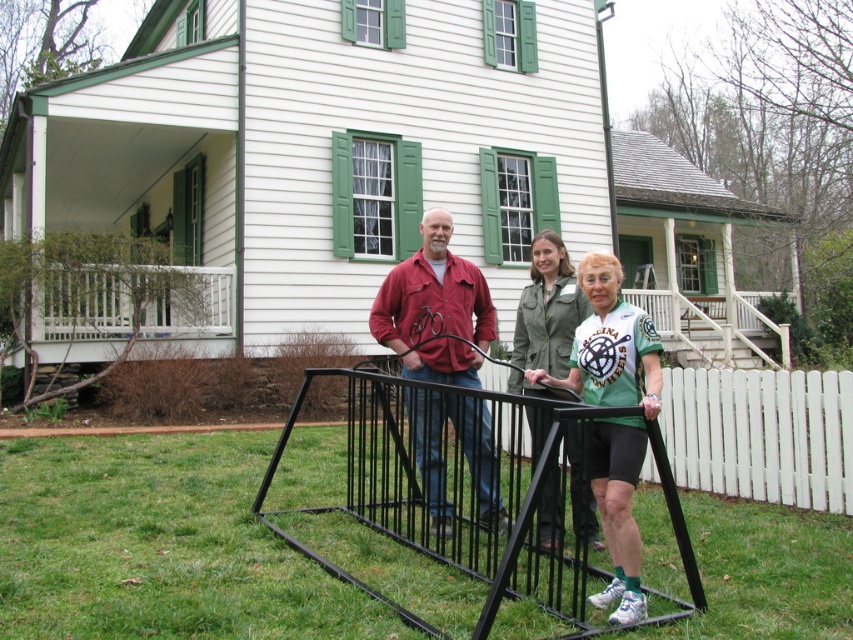
Question: Which object is the farthest from the matte red shirt at center?

Choices:
 (A) matte black bicycle at center
 (B) green fabric shirt at center
 (C) black metal cage at center

Answer: (B)

Question: Observing the image, what is the correct spatial positioning of matte black bicycle at center in reference to matte red shirt at center?

Choices:
 (A) left
 (B) right

Answer: (A)

Question: Is matte black bicycle at center smaller than matte red shirt at center?

Choices:
 (A) yes
 (B) no

Answer: (A)

Question: Is matte black bicycle at center above matte red shirt at center?

Choices:
 (A) no
 (B) yes

Answer: (A)

Question: Which of the following is the closest to the observer?

Choices:
 (A) (x=403, y=368)
 (B) (x=607, y=292)
 (C) (x=598, y=358)
 (D) (x=592, y=538)

Answer: (B)

Question: Which object is the closest to the black metal cage at center?

Choices:
 (A) green fabric shirt at center
 (B) matte red shirt at center

Answer: (B)